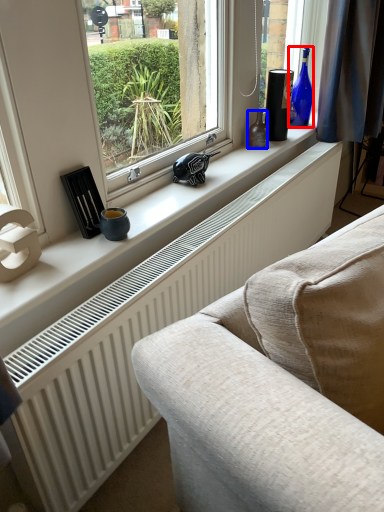
Question: Which of the following is the farthest to the observer, bottle (highlighted by a red box) or bottle (highlighted by a blue box)?

Choices:
 (A) bottle
 (B) bottle

Answer: (A)